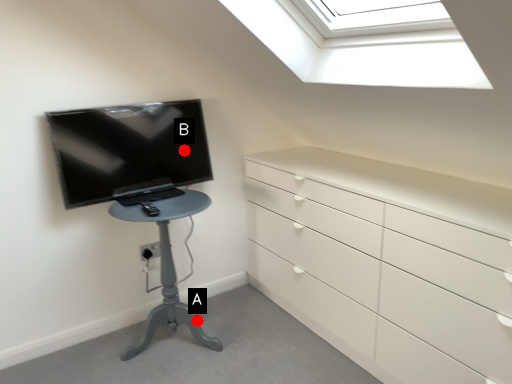
Question: Two points are circled on the image, labeled by A and B beside each circle. Which point is closer to the camera taking this photo?

Choices:
 (A) A is closer
 (B) B is closer

Answer: (A)